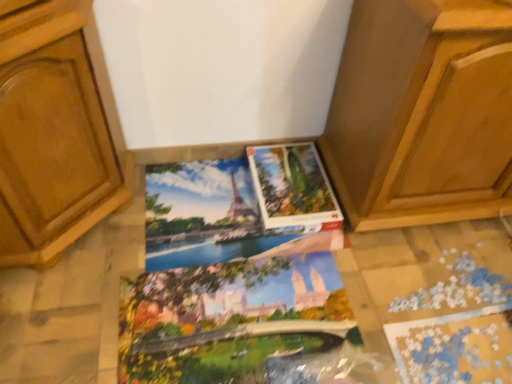
What are the coordinates of `free spot to the left of matte cardboard puzzle at center` in the screenshot? It's located at (206, 203).